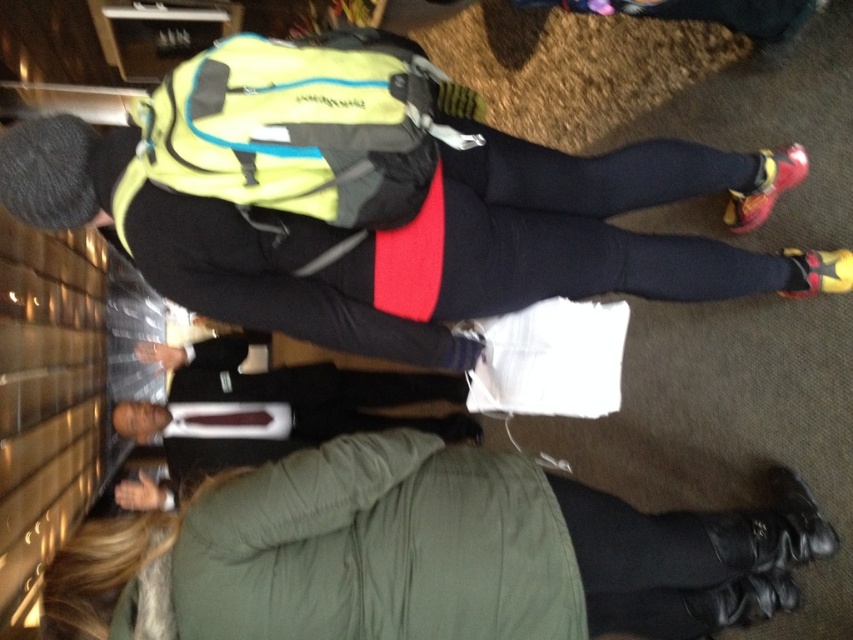
Question: Which point appears farthest from the camera in this image?

Choices:
 (A) (282, 595)
 (B) (13, 136)

Answer: (B)

Question: Where is green textured coat at lower center located in relation to matte black backpack at center in the image?

Choices:
 (A) above
 (B) below

Answer: (B)

Question: Among these objects, which one is farthest from the camera?

Choices:
 (A) green textured coat at lower center
 (B) matte black backpack at center

Answer: (B)

Question: Is green textured coat at lower center in front of matte black backpack at center?

Choices:
 (A) yes
 (B) no

Answer: (A)

Question: Does green textured coat at lower center come in front of matte black backpack at center?

Choices:
 (A) yes
 (B) no

Answer: (A)